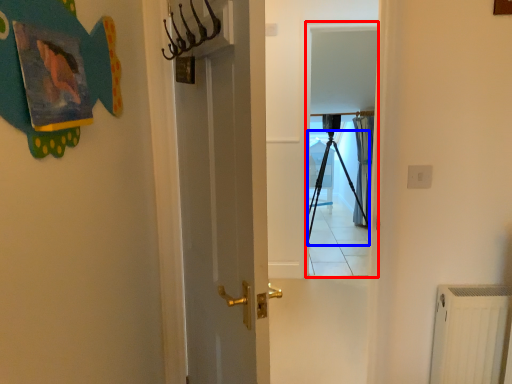
Question: Which of the following is the farthest to the observer, screen door (highlighted by a red box) or tripod (highlighted by a blue box)?

Choices:
 (A) screen door
 (B) tripod

Answer: (B)